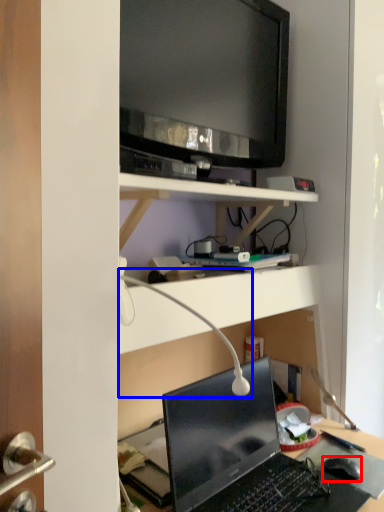
Question: Which object appears farthest to the camera in this image, computer mouse (highlighted by a red box) or table lamp (highlighted by a blue box)?

Choices:
 (A) computer mouse
 (B) table lamp

Answer: (A)